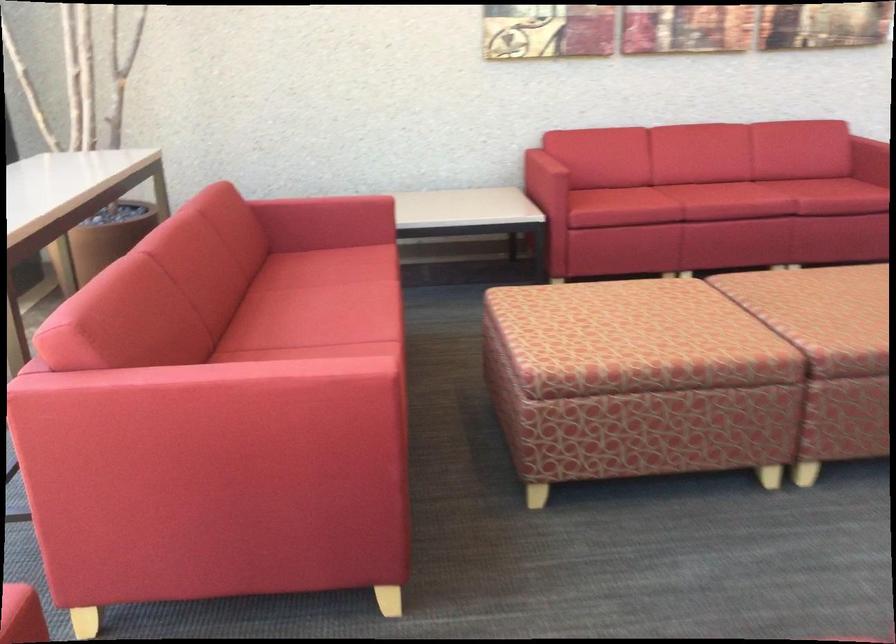
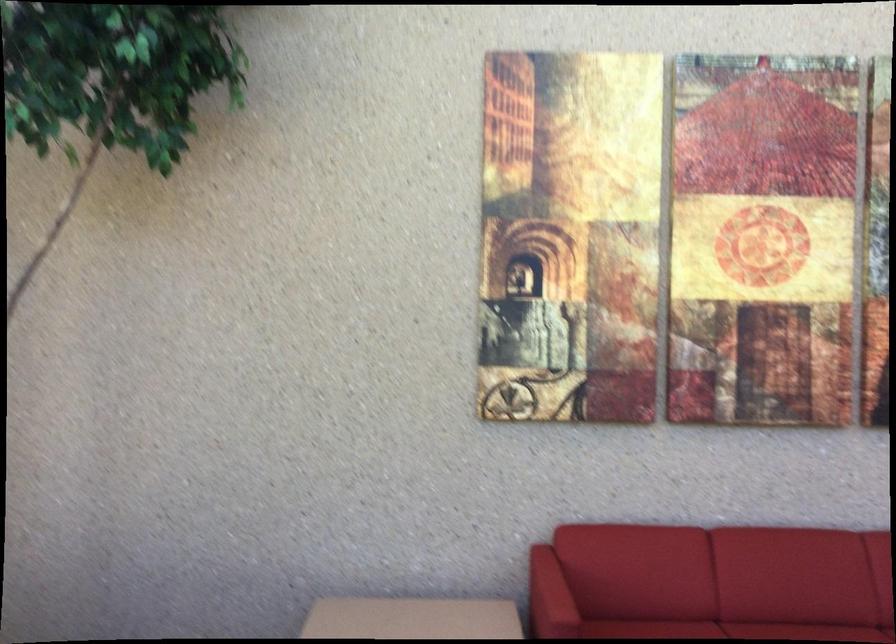
In the second image, find the point that corresponds to point 650,184 in the first image.

(727, 630)